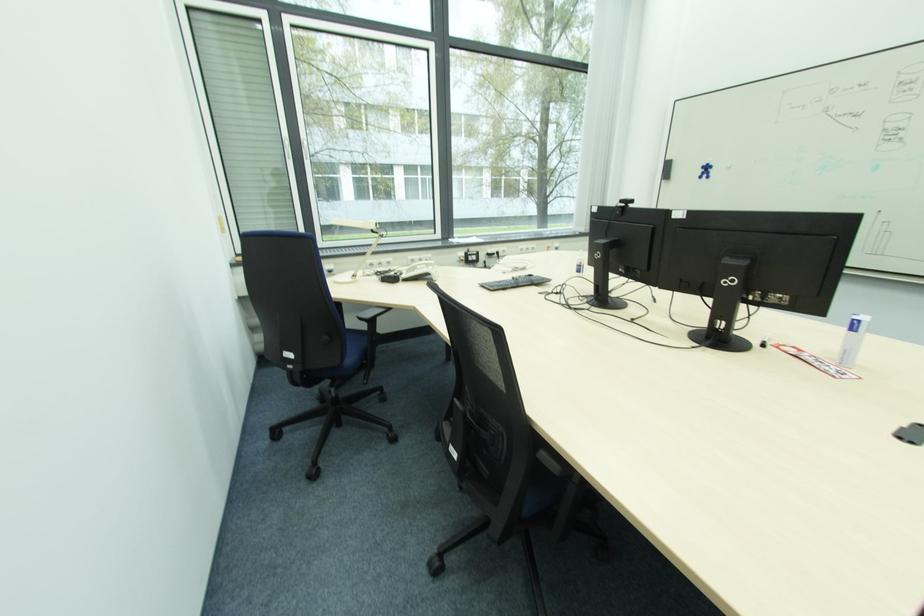
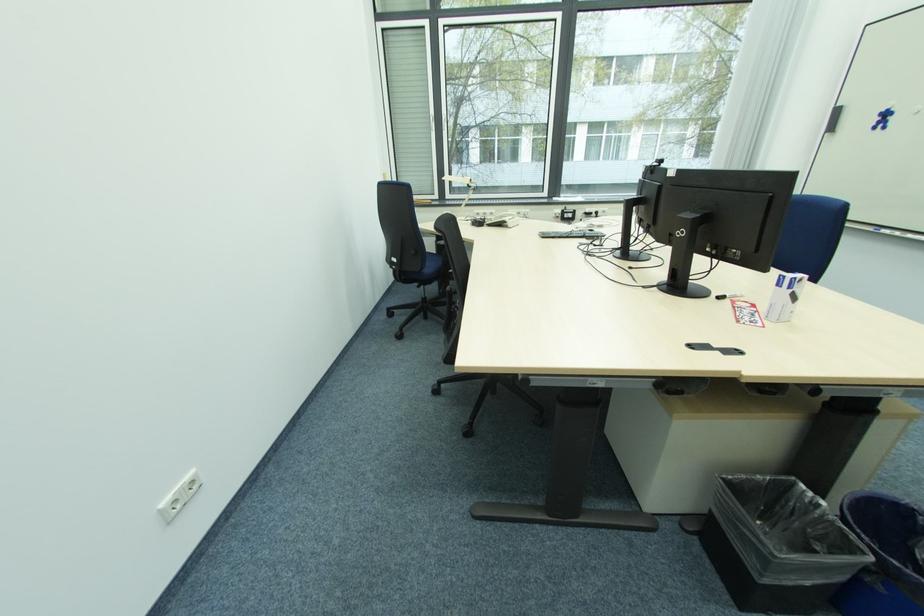
Where in the second image is the point corresponding to (x=346, y=363) from the first image?

(427, 272)